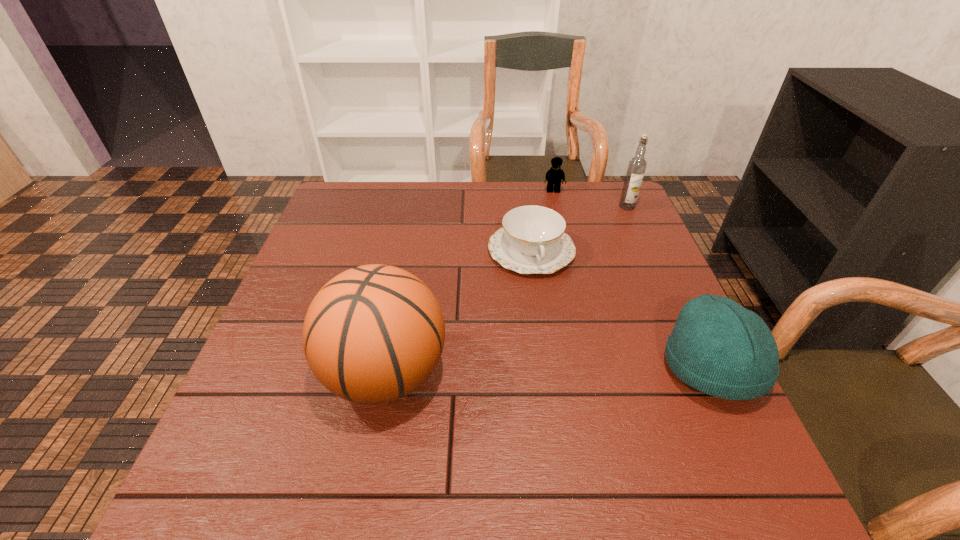
This screenshot has height=540, width=960. I want to click on vodka situated at the far edge, so click(x=636, y=168).

Identify the location of basketball that is at the near edge. This screenshot has width=960, height=540. (373, 334).

This screenshot has height=540, width=960. In order to click on beanie present at the near edge in this screenshot , I will do click(x=718, y=347).

The image size is (960, 540). I want to click on object located in the left edge section of the desktop, so click(x=373, y=334).

Find the location of `beanie situated at the right edge`. beanie situated at the right edge is located at coordinates (718, 347).

Find the location of a particular element. The image size is (960, 540). vodka that is at the right edge is located at coordinates (636, 168).

Locate an element on the screen. The height and width of the screenshot is (540, 960). object positioned at the near left corner is located at coordinates 373,334.

Where is `object present at the far right corner`? object present at the far right corner is located at coordinates (636, 168).

The width and height of the screenshot is (960, 540). I want to click on object that is at the near right corner, so click(x=718, y=347).

You are a GUI agent. You are given a task and a screenshot of the screen. Output one action in this format:
    pyautogui.click(x=<x>, y=<y>)
    Task: Click on the free space at the far edge of the desktop
    Image resolution: width=960 pixels, height=540 pixels.
    Given the screenshot: What is the action you would take?
    pyautogui.click(x=512, y=190)